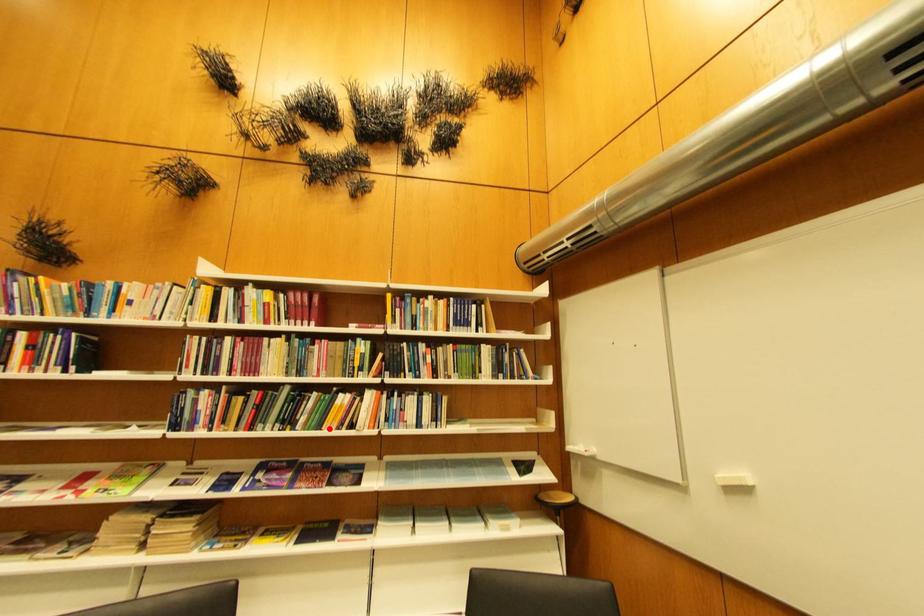
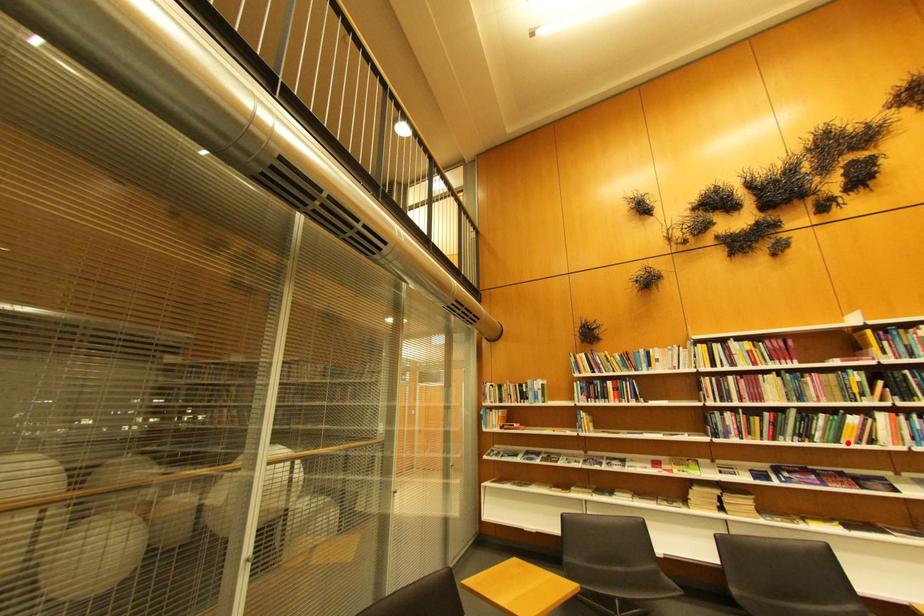
I am providing you with two images of the same scene from different viewpoints. A red point is marked on the first image and another point is marked on the second image. Do the highlighted points in image1 and image2 indicate the same real-world spot?

Yes